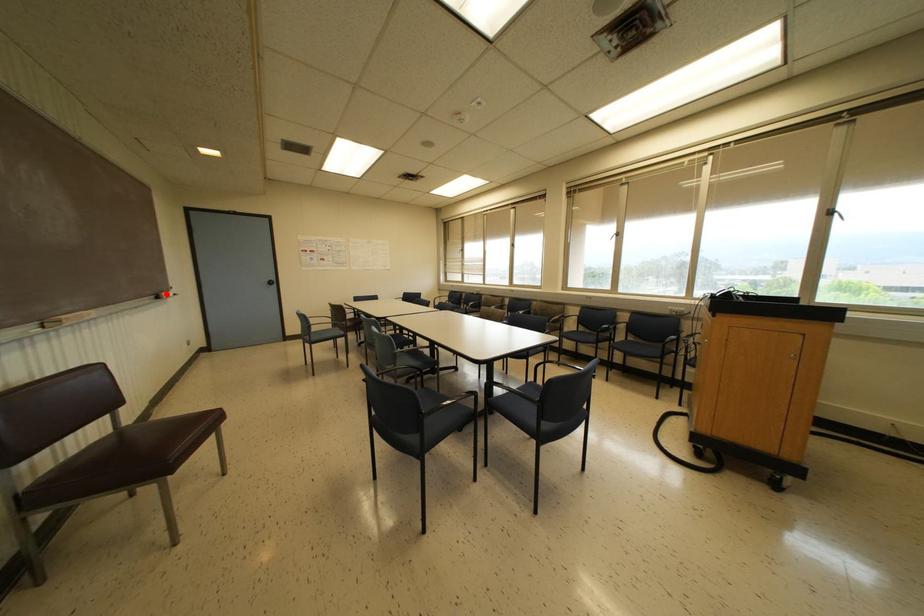
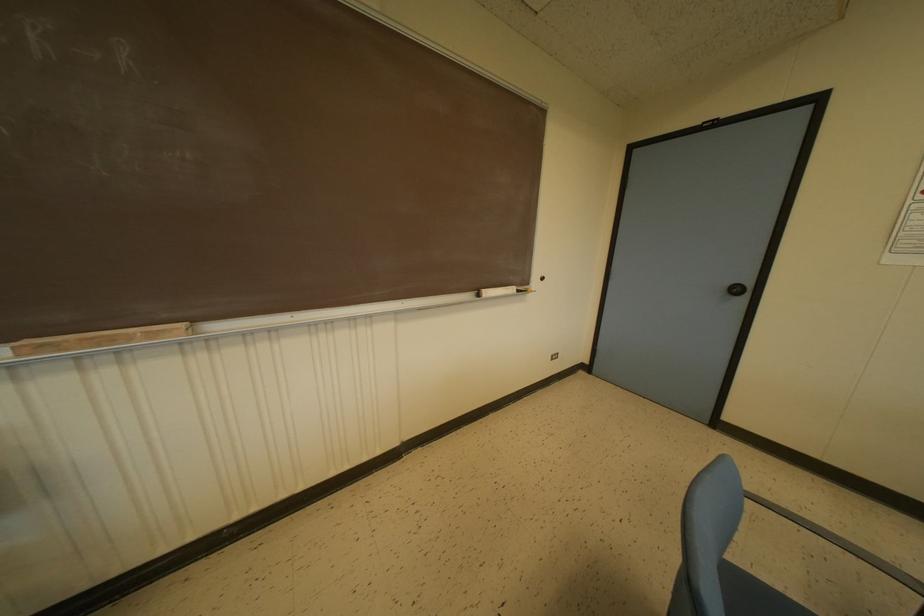
Locate, in the second image, the point that corresponds to the highlighted location in the first image.

(487, 292)